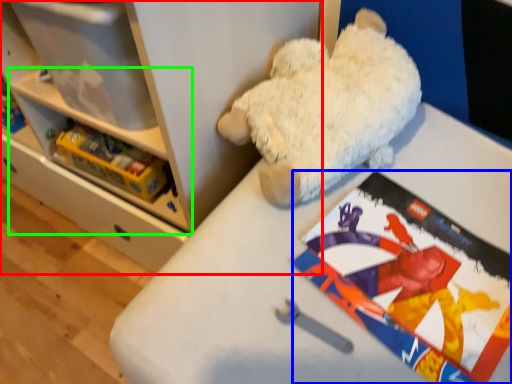
Question: Based on their relative distances, which object is nearer to shelf (highlighted by a red box)? Choose from comic book (highlighted by a blue box) and shelf (highlighted by a green box).

Choices:
 (A) comic book
 (B) shelf

Answer: (B)